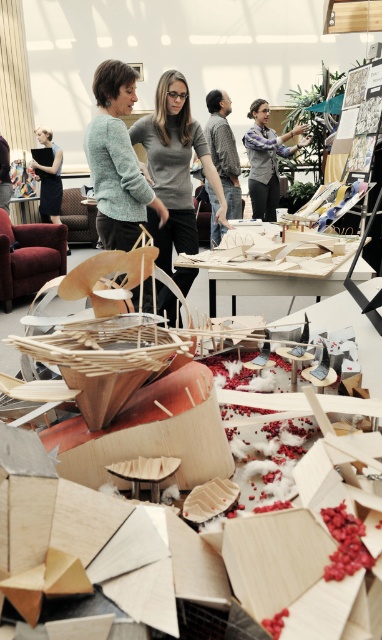
You are an observer in the studio and want to identify which clothing item takes up more visual space in the image. Which one is bigger between the plaid shirt at upper center and the matte black dress at left?

The plaid shirt at upper center is larger in size than the matte black dress at left, so it takes up more visual space in the image.

You are a photographer setting up a shoot in this studio. You need to place a small prop between the matte gray sweater at center and the plaid shirt at upper center. Based on their sizes, which object should the prop be closer to?

The matte gray sweater at center is smaller than the plaid shirt at upper center, so the prop should be placed closer to the plaid shirt at upper center to balance the composition.